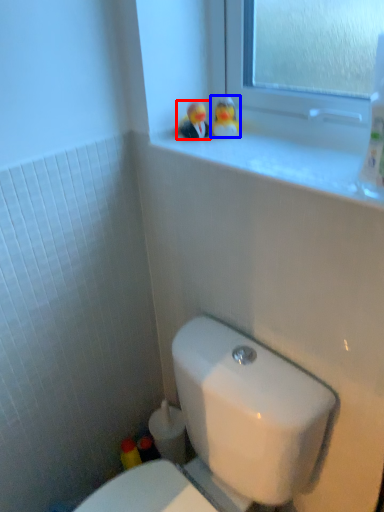
Question: Which object is closer to the camera taking this photo, miniature (highlighted by a red box) or miniature (highlighted by a blue box)?

Choices:
 (A) miniature
 (B) miniature

Answer: (A)